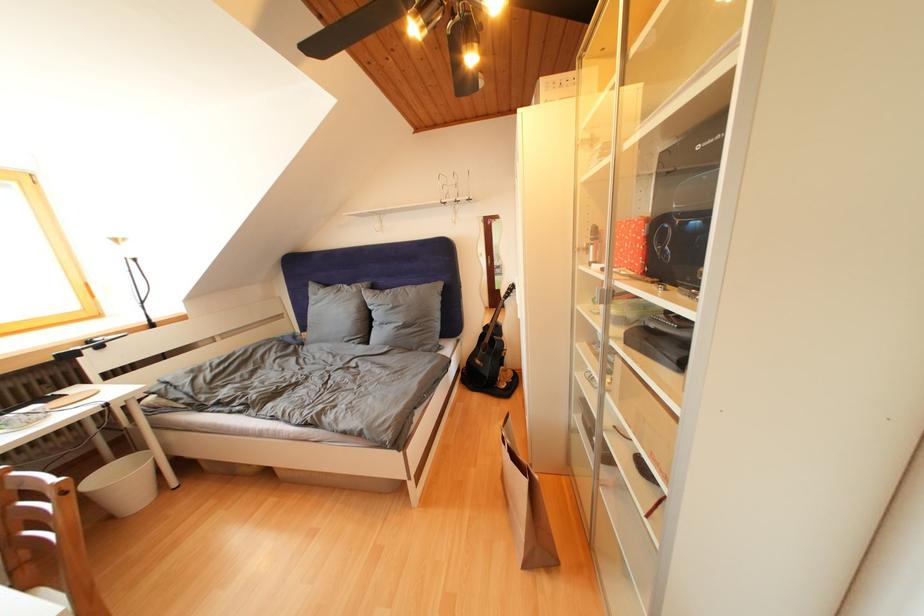
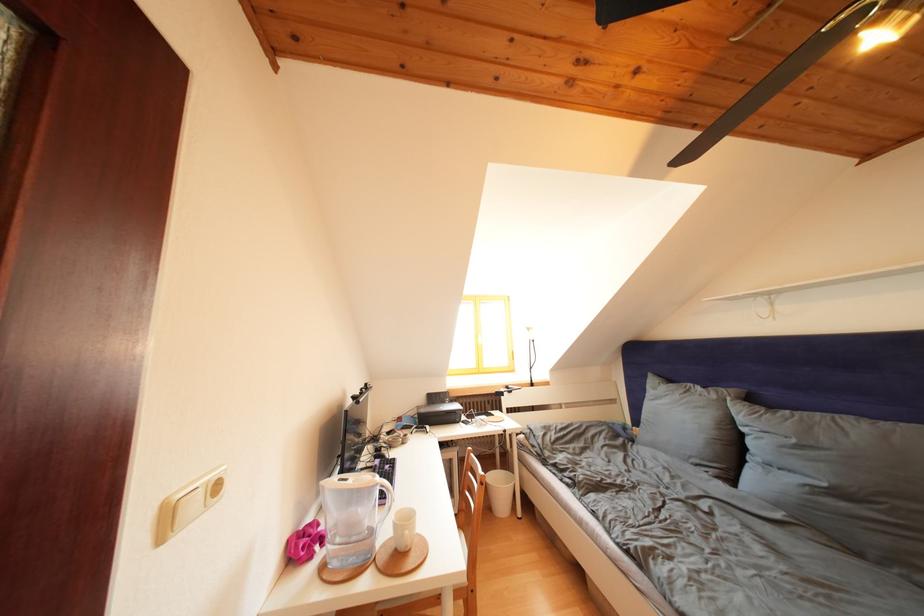
The point at (362, 294) is marked in the first image. Where is the corresponding point in the second image?

(722, 402)